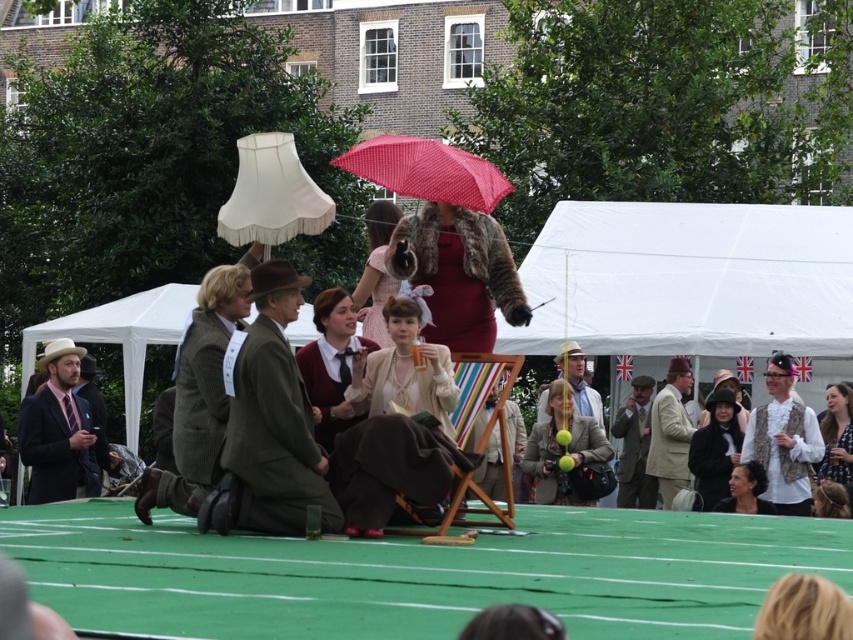
Question: Estimate the real-world distances between objects in this image. Which object is farther from the fur coat at center?

Choices:
 (A) smooth brown hair at lower right
 (B) tan wool suit at center
 (C) velvet maroon sweater at center
 (D) light brown textured coat at center

Answer: (A)

Question: Is tan wool suit at center thinner than blue floral dress at lower right?

Choices:
 (A) no
 (B) yes

Answer: (A)

Question: Does matte pink dress at center appear over blue floral dress at lower right?

Choices:
 (A) yes
 (B) no

Answer: (A)

Question: Which is nearer to the white fabric lampshade at upper center?

Choices:
 (A) white textured vest at center
 (B) pink dotted fabric umbrella at upper center
 (C) white fabric canopy at left
 (D) light brown tweed suit at center

Answer: (B)

Question: Which of these objects is positioned farthest from the green wool coat at center?

Choices:
 (A) matte black suit at left
 (B) matte beige coat at center
 (C) matte beige dress at center
 (D) white fabric lampshade at upper center

Answer: (B)

Question: Can you confirm if matte black hat at center is wider than light brown tweed suit at center?

Choices:
 (A) yes
 (B) no

Answer: (A)